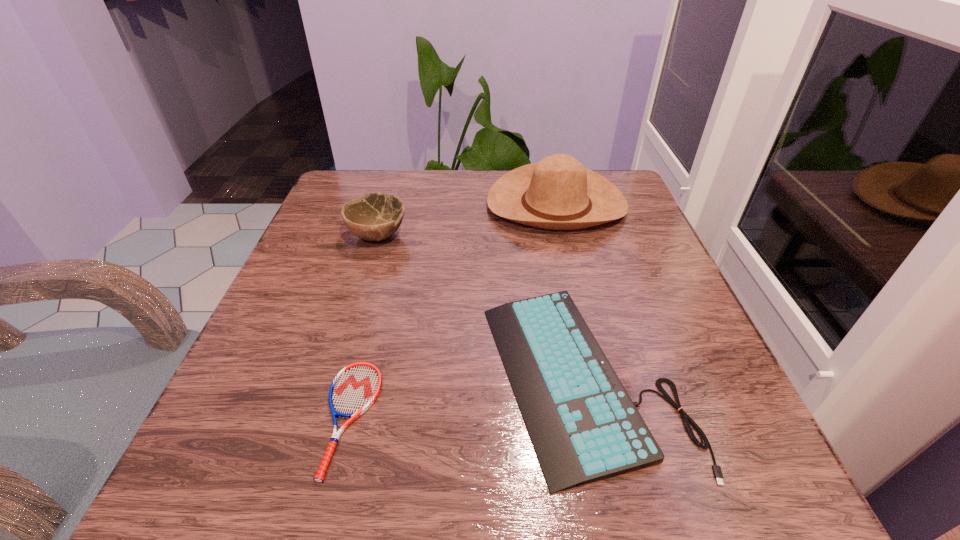
Find the location of a particular element. cowboy hat is located at coordinates (559, 193).

Identify the location of bowl. (374, 217).

Where is `computer keyboard`? The width and height of the screenshot is (960, 540). computer keyboard is located at coordinates (584, 427).

You are a GUI agent. You are given a task and a screenshot of the screen. Output one action in this format:
    pyautogui.click(x=<x>, y=<y>)
    Task: Click on the tennis racket
    The height and width of the screenshot is (540, 960).
    Given the screenshot: What is the action you would take?
    pyautogui.click(x=355, y=388)

Locate an element on the screen. Image resolution: width=960 pixels, height=540 pixels. free region located 0.130m on the front-facing side of the cowboy hat is located at coordinates (574, 280).

I want to click on free region located on the right of the bowl, so click(x=444, y=236).

Find the location of `vacant space located 0.070m on the right of the second shortest object`. vacant space located 0.070m on the right of the second shortest object is located at coordinates (727, 377).

Where is `free region located on the back of the shortest object`? free region located on the back of the shortest object is located at coordinates (387, 268).

At what (x,y) coordinates should I click in order to perform the action: click on cowboy hat at the far edge. Please return your answer as a coordinate pair (x, y). The width and height of the screenshot is (960, 540). Looking at the image, I should click on (559, 193).

Find the location of a particular element. This screenshot has width=960, height=540. bowl at the far edge is located at coordinates (374, 217).